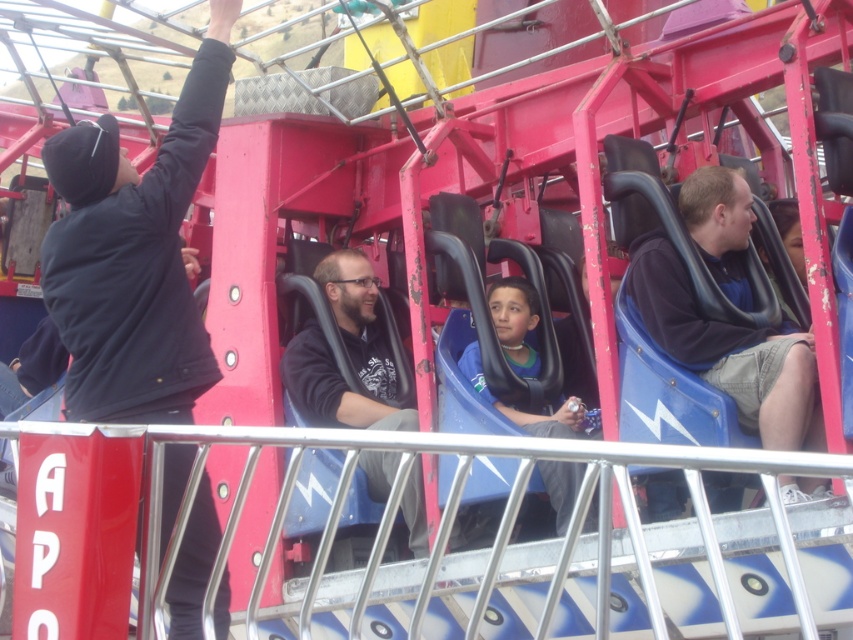
Which is behind, point (759, 410) or point (479, 381)?

The point (479, 381) is behind.

Does matte blue seat at center appear over blue matte seat at center?

Yes, matte blue seat at center is above blue matte seat at center.

Between point (693, 186) and point (567, 464), which one is positioned behind?

The point (567, 464) is behind.

Where is `matte blue seat at center`? Image resolution: width=853 pixels, height=640 pixels. matte blue seat at center is located at coordinates (730, 352).

Does point (132, 342) come in front of point (755, 394)?

Yes.

Between point (219, 116) and point (715, 323), which one is positioned behind?

The point (219, 116) is behind.

The height and width of the screenshot is (640, 853). I want to click on black matte jacket at upper left, so click(134, 253).

Where is `black matte jacket at upper left`? This screenshot has height=640, width=853. black matte jacket at upper left is located at coordinates (134, 253).

Which is above, matte blue seat at center or matte black jacket at center?

matte blue seat at center is above.

Who is more forward, (734, 346) or (357, 317)?

Point (734, 346)

Locate an element on the screen. The image size is (853, 640). matte blue seat at center is located at coordinates pyautogui.click(x=730, y=352).